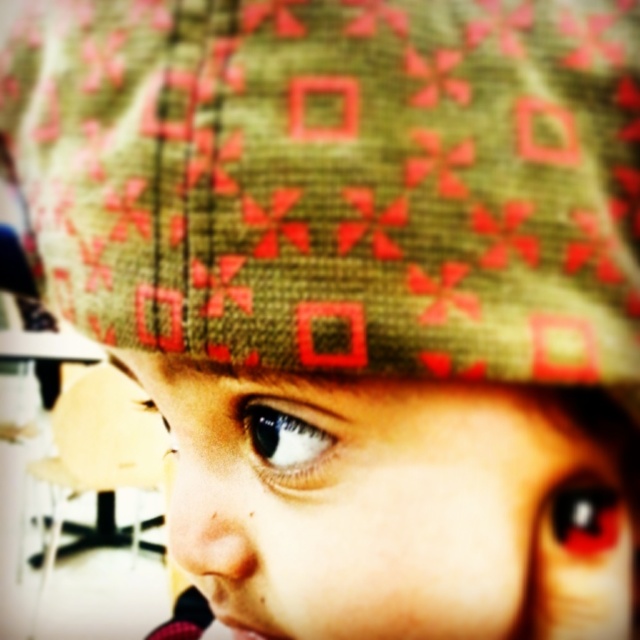
Question: Is black glossy eye at center to the left of shiny blue eye at center from the viewer's perspective?

Choices:
 (A) yes
 (B) no

Answer: (B)

Question: Is black glossy eye at center bigger than shiny blue eye at center?

Choices:
 (A) no
 (B) yes

Answer: (A)

Question: Among these points, which one is nearest to the camera?

Choices:
 (A) (568, 525)
 (B) (256, 416)

Answer: (B)

Question: Considering the relative positions of black glossy eye at center and shiny blue eye at center in the image provided, where is black glossy eye at center located with respect to shiny blue eye at center?

Choices:
 (A) below
 (B) above

Answer: (A)

Question: Among these objects, which one is nearest to the camera?

Choices:
 (A) black glossy eye at center
 (B) shiny blue eye at center

Answer: (B)